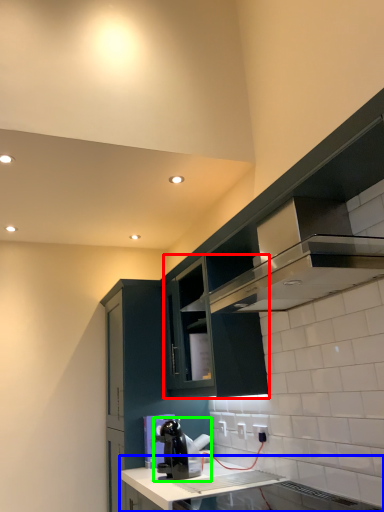
Question: Which is nearer to the cabinetry (highlighted by a red box)? countertop (highlighted by a blue box) or home appliance (highlighted by a green box).

Choices:
 (A) countertop
 (B) home appliance

Answer: (B)